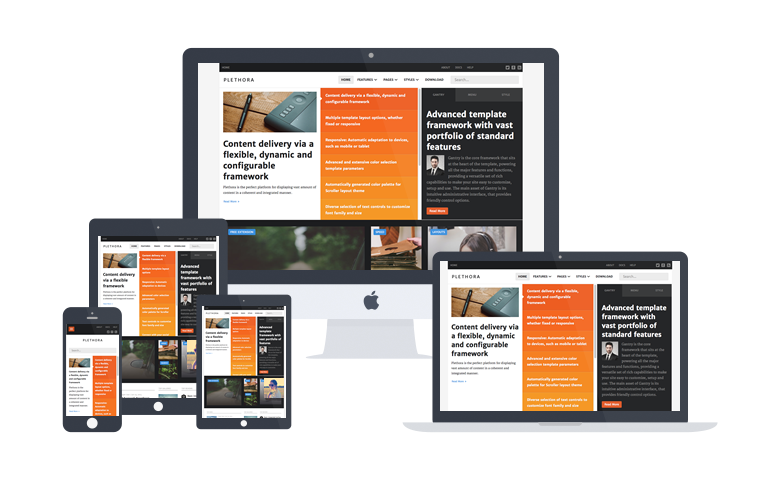
Where is `laptop`? The height and width of the screenshot is (480, 780). laptop is located at coordinates (511, 258), (465, 53).